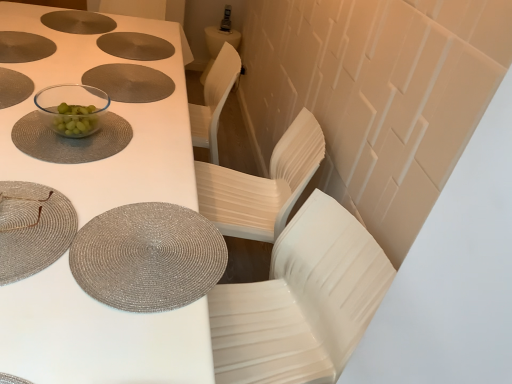
Image resolution: width=512 pixels, height=384 pixels. Identify the location of free space underneath transparent glass bowl at center, placed as the third tableware when sorted from back to front (from a real-world perspective). (74, 145).